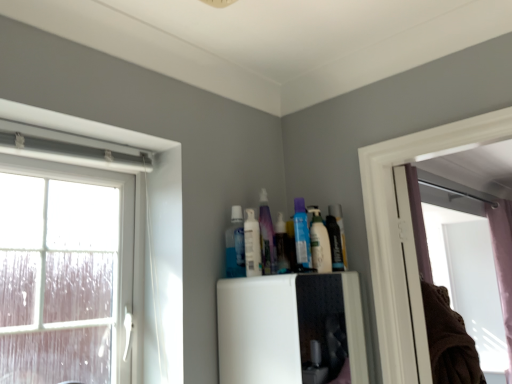
Question: Would you say clear glass window at left is part of translucent plastic spray bottle at upper center, which is the fifth toiletry in left-to-right order,'s contents?

Choices:
 (A) yes
 (B) no

Answer: (B)

Question: Does translucent plastic spray bottle at upper center, which is the fifth toiletry in left-to-right order, turn towards clear glass window at left?

Choices:
 (A) no
 (B) yes

Answer: (A)

Question: Is translucent plastic spray bottle at upper center, which is the 1th toiletry from right to left, at the right side of clear glass window at left?

Choices:
 (A) no
 (B) yes

Answer: (B)

Question: Does translucent plastic spray bottle at upper center, which is the fifth toiletry in left-to-right order, have a larger size compared to clear glass window at left?

Choices:
 (A) yes
 (B) no

Answer: (B)

Question: From a real-world perspective, is translucent plastic spray bottle at upper center, which is the fifth toiletry in left-to-right order, positioned over clear glass window at left based on gravity?

Choices:
 (A) no
 (B) yes

Answer: (B)

Question: In terms of height, does translucent plastic spray bottle at upper center, which is the 1th toiletry from right to left, look taller or shorter compared to white glossy lotion at upper center, positioned as the second toiletry in left-to-right order?

Choices:
 (A) short
 (B) tall

Answer: (A)

Question: Is point (317, 208) closer or farther from the camera than point (253, 274)?

Choices:
 (A) closer
 (B) farther

Answer: (B)

Question: From a real-world perspective, is translucent plastic spray bottle at upper center, which is the fifth toiletry in left-to-right order, positioned above or below white glossy lotion at upper center, positioned as the second toiletry in left-to-right order?

Choices:
 (A) below
 (B) above

Answer: (A)

Question: In terms of width, does translucent plastic spray bottle at upper center, which is the fifth toiletry in left-to-right order, look wider or thinner when compared to white glossy lotion at upper center, positioned as the second toiletry in left-to-right order?

Choices:
 (A) thin
 (B) wide

Answer: (B)

Question: Considering the positions of white glossy lotion at upper center, positioned as the second toiletry in left-to-right order, and brown cotton laundry at right in the image, is white glossy lotion at upper center, positioned as the second toiletry in left-to-right order, taller or shorter than brown cotton laundry at right?

Choices:
 (A) tall
 (B) short

Answer: (B)

Question: From the image's perspective, is white glossy lotion at upper center, which ranks as the fourth toiletry in right-to-left order, positioned above or below brown cotton laundry at right?

Choices:
 (A) above
 (B) below

Answer: (A)

Question: Is white glossy lotion at upper center, positioned as the second toiletry in left-to-right order, wider or thinner than brown cotton laundry at right?

Choices:
 (A) wide
 (B) thin

Answer: (B)

Question: From a real-world perspective, is white glossy lotion at upper center, which ranks as the fourth toiletry in right-to-left order, positioned above or below brown cotton laundry at right?

Choices:
 (A) above
 (B) below

Answer: (A)

Question: Is point (432, 309) closer or farther from the camera than point (285, 271)?

Choices:
 (A) farther
 (B) closer

Answer: (A)

Question: From the image's perspective, is brown cotton laundry at right located above or below translucent plastic bottle at upper center, arranged as the fourth toiletry when viewed from the left?

Choices:
 (A) above
 (B) below

Answer: (B)